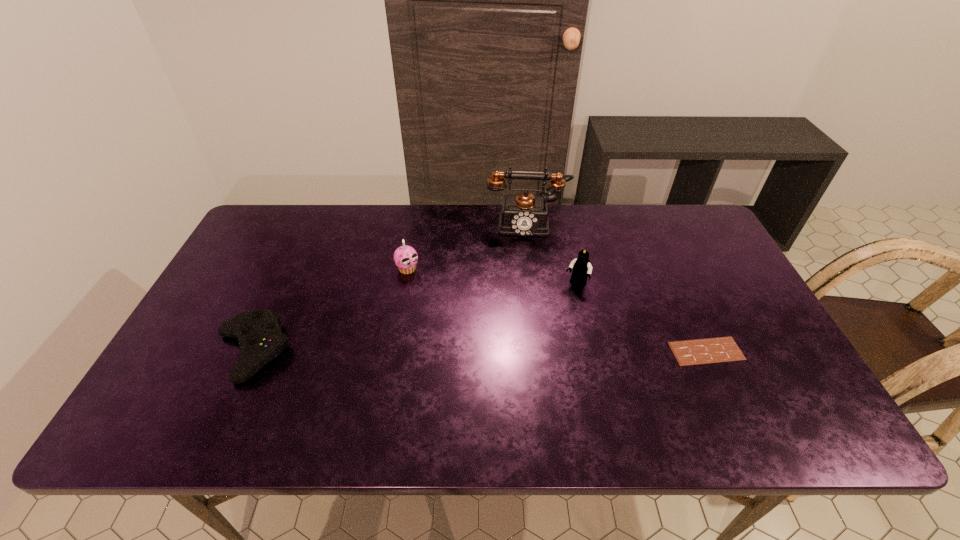
Locate an element on the screen. object at the near edge is located at coordinates (260, 337).

This screenshot has height=540, width=960. I want to click on object that is at the left edge, so click(x=260, y=337).

Locate an element on the screen. object present at the right edge is located at coordinates (722, 349).

The image size is (960, 540). Find the location of `object that is at the near left corner`. object that is at the near left corner is located at coordinates pos(260,337).

This screenshot has width=960, height=540. Find the location of `vacant space at the far edge of the desktop`. vacant space at the far edge of the desktop is located at coordinates (322, 235).

The width and height of the screenshot is (960, 540). In the image, there is a desktop. Identify the location of vacant space at the near edge. (432, 385).

You are a GUI agent. You are given a task and a screenshot of the screen. Output one action in this format:
    pyautogui.click(x=<x>, y=<y>)
    Task: Click on the free space at the left edge
    This screenshot has height=540, width=960.
    Given the screenshot: What is the action you would take?
    pyautogui.click(x=192, y=354)

In the image, there is a desktop. Where is `free space at the right edge`? The width and height of the screenshot is (960, 540). free space at the right edge is located at coordinates (687, 264).

Find the location of a particular element. The image size is (960, 540). free space at the far left corner is located at coordinates (263, 222).

In order to click on vacant area between the farthest object and the shortest object in this screenshot , I will do `click(616, 287)`.